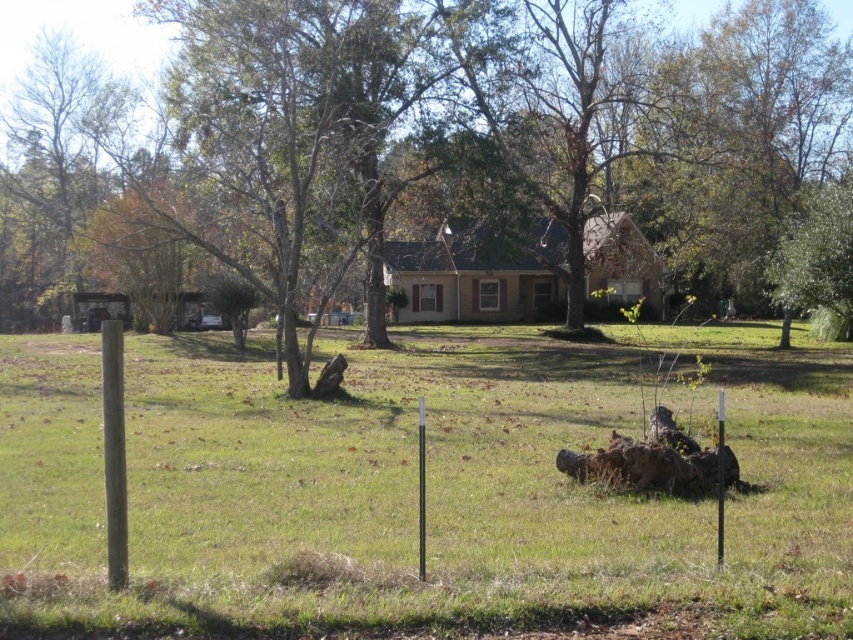
You are standing in the suburban scene and want to place a small garden ornament between the green grass at center and the brown wood tree at center. Based on their positions, which object should you place the ornament closer to?

The green grass at center is positioned on the right side of the brown wood tree at center, so you should place the ornament closer to the brown wood tree at center to be between them.